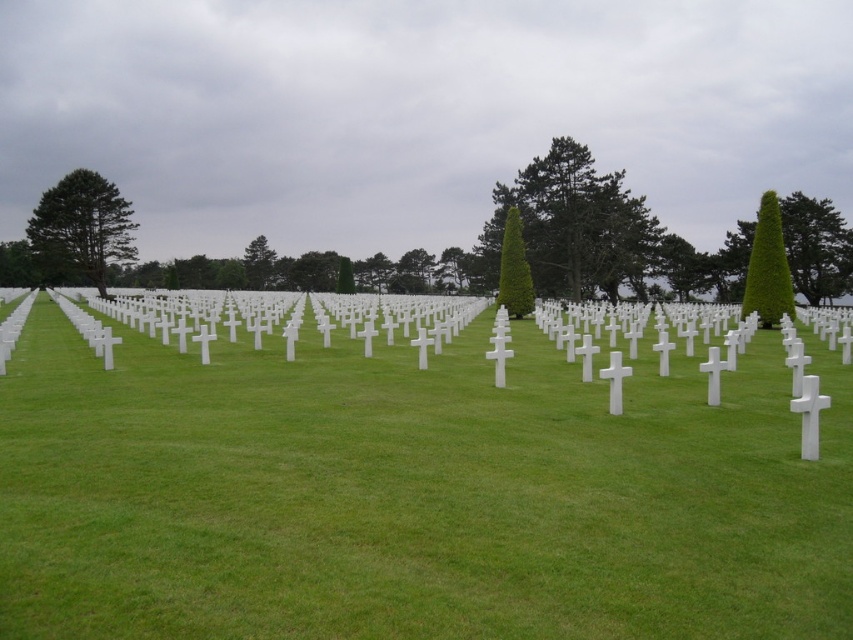
Question: Does green leafy tree at right appear over green leafy tree at center?

Choices:
 (A) no
 (B) yes

Answer: (A)

Question: Which point appears closest to the camera in this image?

Choices:
 (A) (494, 218)
 (B) (827, 273)
 (C) (125, 236)
 (D) (787, 310)

Answer: (D)

Question: Is green grassy at center closer to the viewer compared to green leafy cone at center-right?

Choices:
 (A) yes
 (B) no

Answer: (A)

Question: Which object is closer to the camera taking this photo?

Choices:
 (A) green grassy at center
 (B) green textured pine tree at center

Answer: (A)

Question: Is green grassy at center to the left of green textured pine tree at center from the viewer's perspective?

Choices:
 (A) yes
 (B) no

Answer: (A)

Question: Which of the following is the farthest from the observer?

Choices:
 (A) (350, 362)
 (B) (820, 289)

Answer: (B)